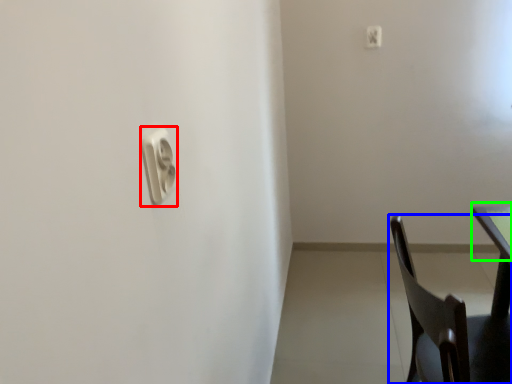
Question: Which object is positioned closest to light switch (highlighted by a red box)? Select from chair (highlighted by a blue box) and table top (highlighted by a green box).

Choices:
 (A) chair
 (B) table top

Answer: (A)